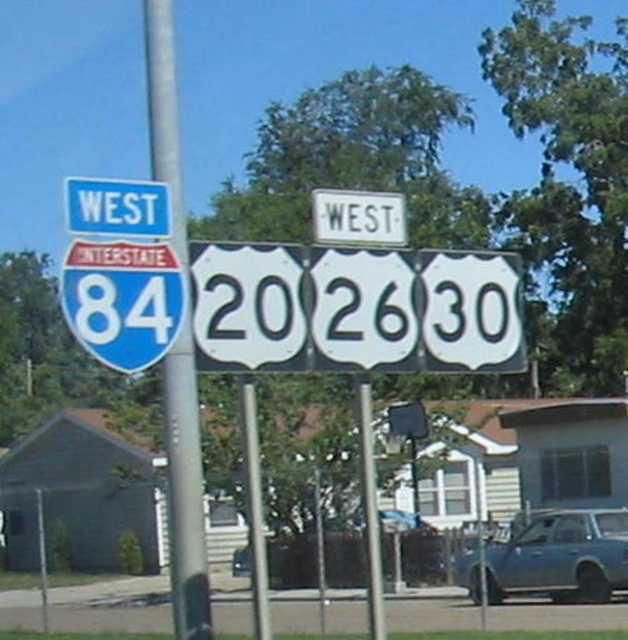
Question: Which point appears farthest from the camera in this image?

Choices:
 (A) (185, 632)
 (B) (585, 586)
 (C) (323, 337)
 (D) (403, 236)

Answer: (B)

Question: Does white plastic road sign at center appear under blue metallic sedan at center?

Choices:
 (A) no
 (B) yes

Answer: (A)

Question: Is white plastic road sign at center to the right of blue metallic sedan at center from the viewer's perspective?

Choices:
 (A) yes
 (B) no

Answer: (B)

Question: Which object is the closest to the white plastic sign at upper center?

Choices:
 (A) metallic gray pole at left
 (B) blue metallic sedan at center

Answer: (A)

Question: Can you confirm if metallic gray pole at left is wider than white plastic sign at upper center?

Choices:
 (A) yes
 (B) no

Answer: (A)

Question: Among these points, which one is farthest from the camera?

Choices:
 (A) (369, 211)
 (B) (344, 262)
 (C) (512, 538)

Answer: (C)